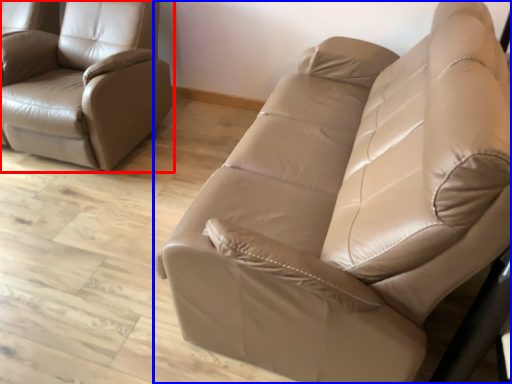
Question: Among these objects, which one is nearest to the camera, chair (highlighted by a red box) or studio couch (highlighted by a blue box)?

Choices:
 (A) chair
 (B) studio couch

Answer: (B)